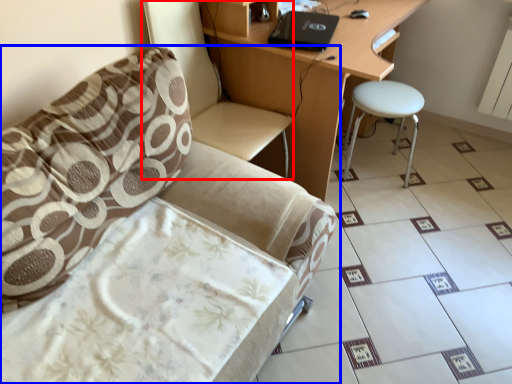
Question: Which point is further to the camera, swivel chair (highlighted by a red box) or chair (highlighted by a blue box)?

Choices:
 (A) swivel chair
 (B) chair

Answer: (A)